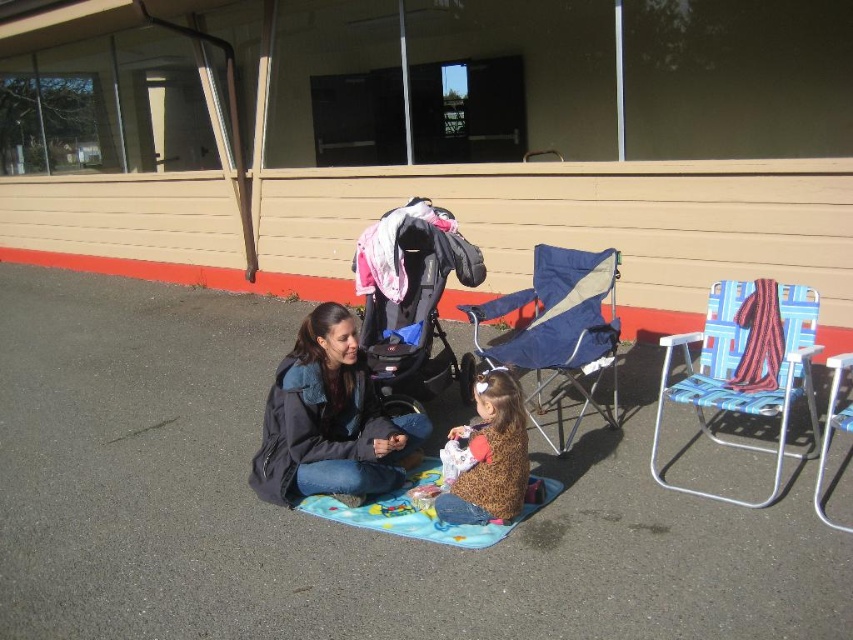
Question: Among these objects, which one is farthest from the camera?

Choices:
 (A) black textured stroller at center
 (B) multicolored fabric mat at center
 (C) blue fabric chair at center

Answer: (A)

Question: Which point is closer to the camera?

Choices:
 (A) (277, 419)
 (B) (462, 356)
 (C) (590, 400)
 (D) (780, 412)

Answer: (D)

Question: Is matte black jacket at center to the right of striped fabric blanket at right from the viewer's perspective?

Choices:
 (A) no
 (B) yes

Answer: (A)

Question: Which of the following is the closest to the observer?

Choices:
 (A) (740, 305)
 (B) (737, 285)
 (C) (521, 300)

Answer: (A)

Question: Can you confirm if leopard print jacket at lower center is positioned below blue fabric chair at lower right?

Choices:
 (A) no
 (B) yes

Answer: (B)

Question: Is leopard print jacket at lower center below multicolored fabric mat at center?

Choices:
 (A) no
 (B) yes

Answer: (A)